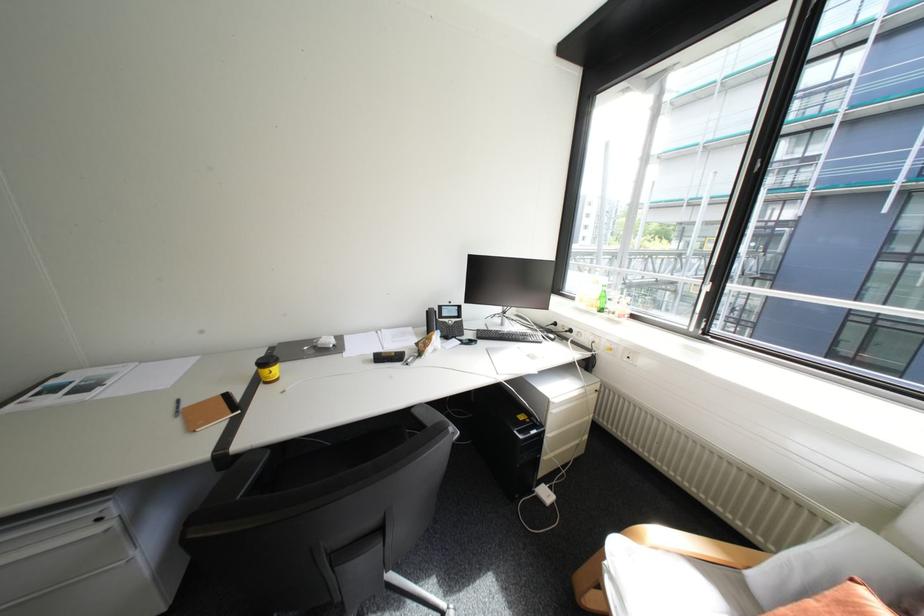
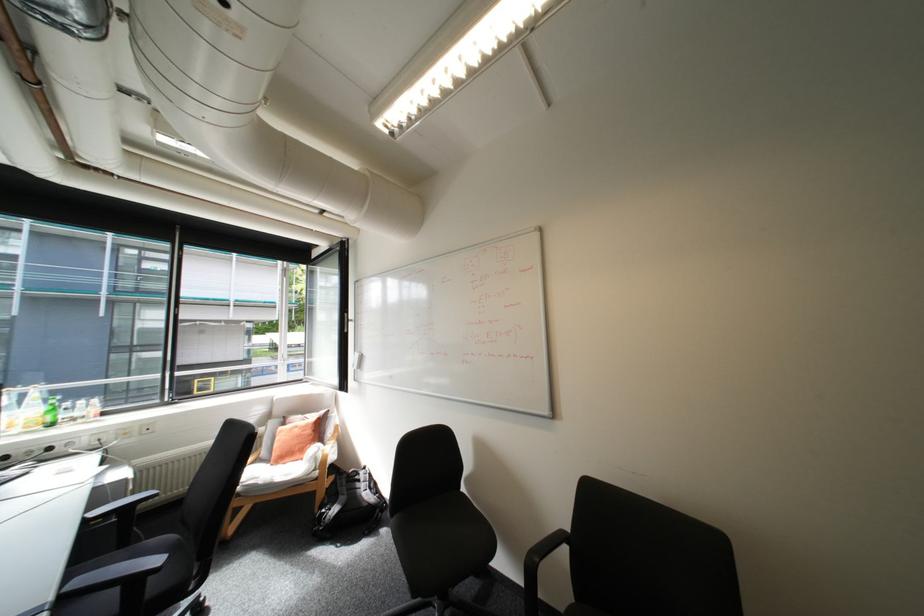
Where in the second image is the point corresponding to point (608, 293) from the first image?

(55, 408)